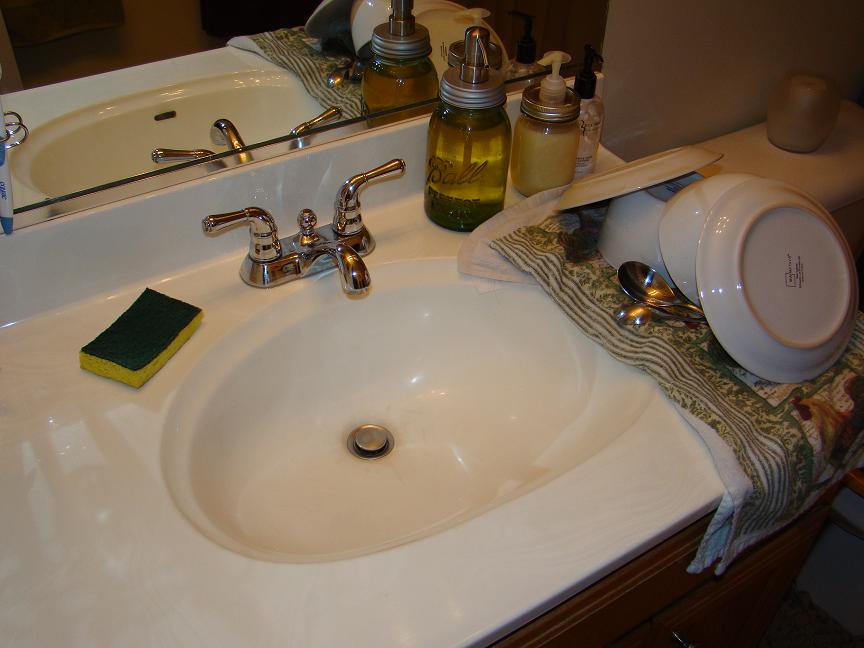
Where is `faucet`? The image size is (864, 648). faucet is located at coordinates (341, 238).